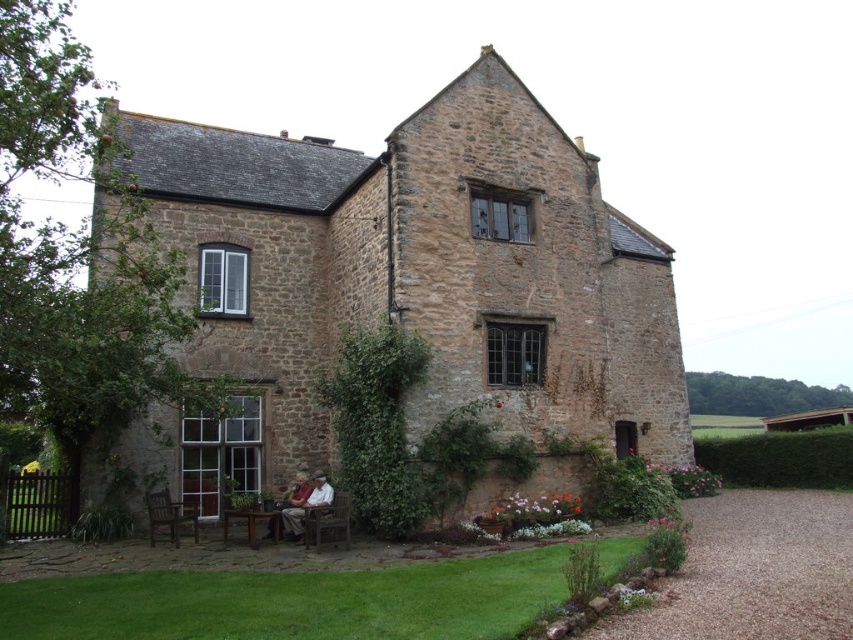
You are standing in front of the house and see the green grass at lower center and the matte brown jacket at lower center. Which object is nearer to you?

The green grass at lower center is closer to the viewer than the matte brown jacket at lower center, so the green grass at lower center is nearer to you.

You are standing in the garden of the traditional stone house. You need to place a small potted plant between the green grass at lower center and the dark brown wooden bench at lower left. Which object should the potted plant be closer to if it needs to be placed at the same height as the bench?

The potted plant should be placed closer to the dark brown wooden bench at lower left because the green grass at lower center is taller than the bench, so positioning it near the bench would ensure it matches the bench height.

You are standing in the garden of the traditional stone house. You see the green grass at lower center and the matte brown jacket at lower center. Which object is wider?

The green grass at lower center is wider than the matte brown jacket at lower center according to the description.